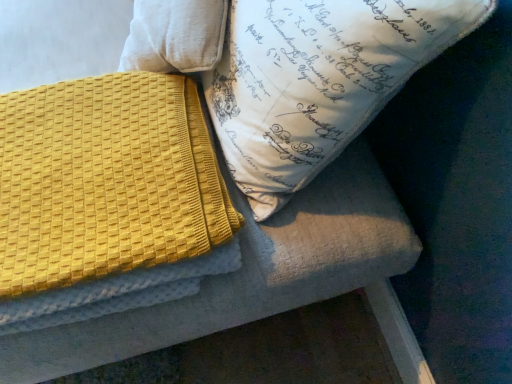
Question: From their relative heights in the image, would you say white printed pillow at upper center is taller or shorter than yellow textured blanket at upper left?

Choices:
 (A) tall
 (B) short

Answer: (A)

Question: Looking at their shapes, would you say white printed pillow at upper center is wider or thinner than yellow textured blanket at upper left?

Choices:
 (A) wide
 (B) thin

Answer: (B)

Question: Is point (370, 77) positioned closer to the camera than point (161, 226)?

Choices:
 (A) closer
 (B) farther

Answer: (A)

Question: Is yellow textured blanket at upper left bigger or smaller than white printed pillow at upper center?

Choices:
 (A) small
 (B) big

Answer: (A)

Question: Considering the positions of yellow textured blanket at upper left and white printed pillow at upper center in the image, is yellow textured blanket at upper left taller or shorter than white printed pillow at upper center?

Choices:
 (A) short
 (B) tall

Answer: (A)

Question: Is point (77, 142) positioned closer to the camera than point (245, 160)?

Choices:
 (A) closer
 (B) farther

Answer: (B)

Question: Is yellow textured blanket at upper left spatially inside white printed pillow at upper center, or outside of it?

Choices:
 (A) outside
 (B) inside

Answer: (A)